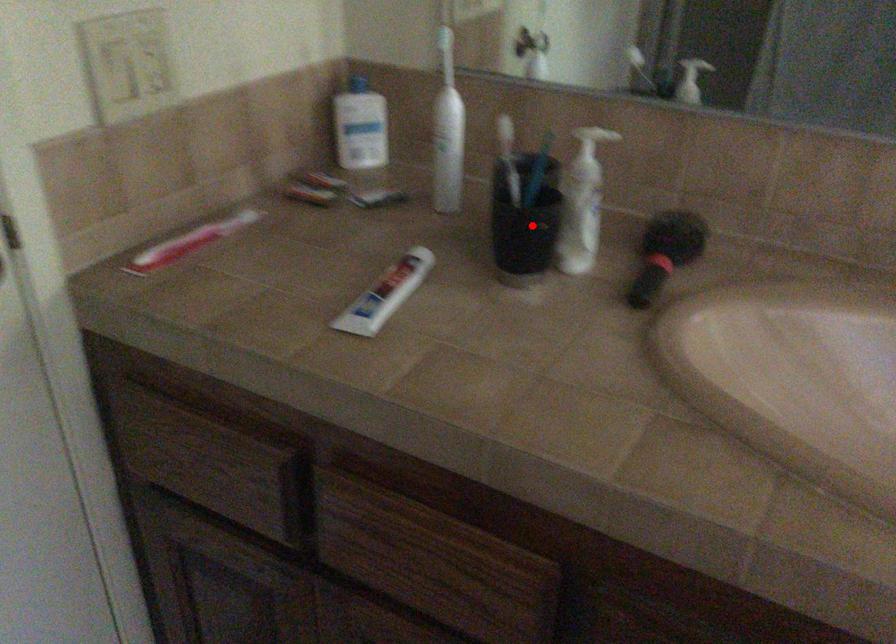
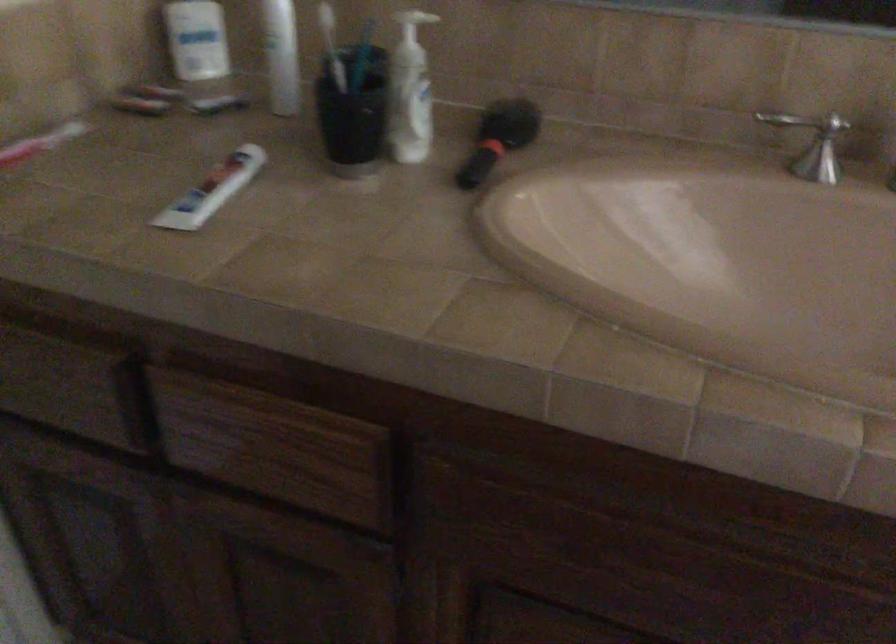
The point at the highlighted location is marked in the first image. Where is the corresponding point in the second image?

(352, 113)